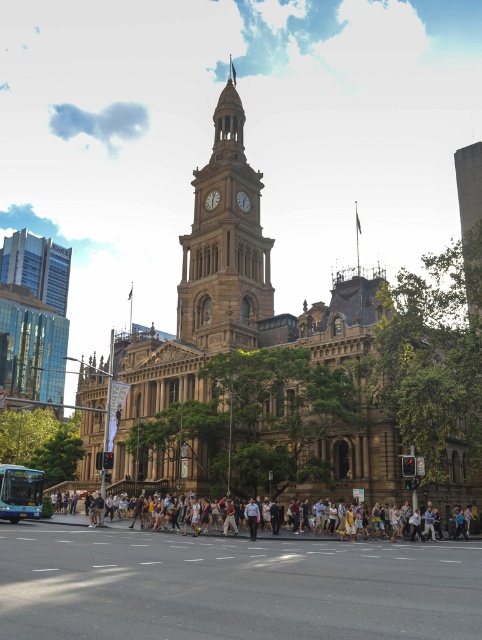
Question: Can you confirm if brown stone clock tower at center is positioned to the right of white glossy clock at center?

Choices:
 (A) no
 (B) yes

Answer: (B)

Question: Does brown stone clock tower at center appear on the right side of gold metallic clock at center?

Choices:
 (A) no
 (B) yes

Answer: (A)

Question: Which of these objects is positioned closest to the white casual clothing at center?

Choices:
 (A) brown stone clock tower at center
 (B) gold metallic clock at center

Answer: (A)

Question: Which of these objects is positioned farthest from the white glossy clock at center?

Choices:
 (A) gold metallic clock at center
 (B) white casual clothing at center

Answer: (B)

Question: Estimate the real-world distances between objects in this image. Which object is farther from the gold metallic clock at center?

Choices:
 (A) white glossy clock at center
 (B) white casual clothing at center
 (C) brown stone clock tower at center

Answer: (B)

Question: Is white casual clothing at center above white glossy clock at center?

Choices:
 (A) yes
 (B) no

Answer: (B)